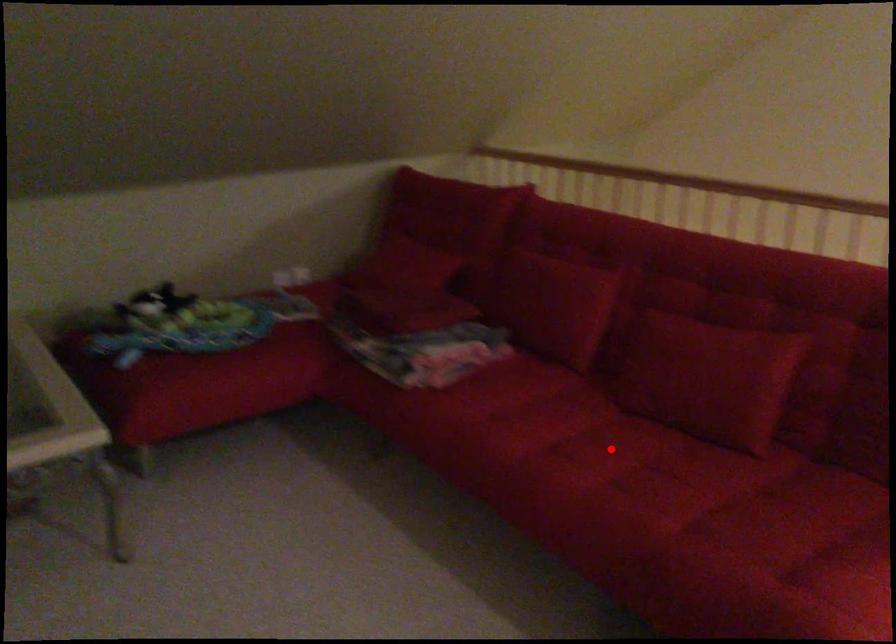
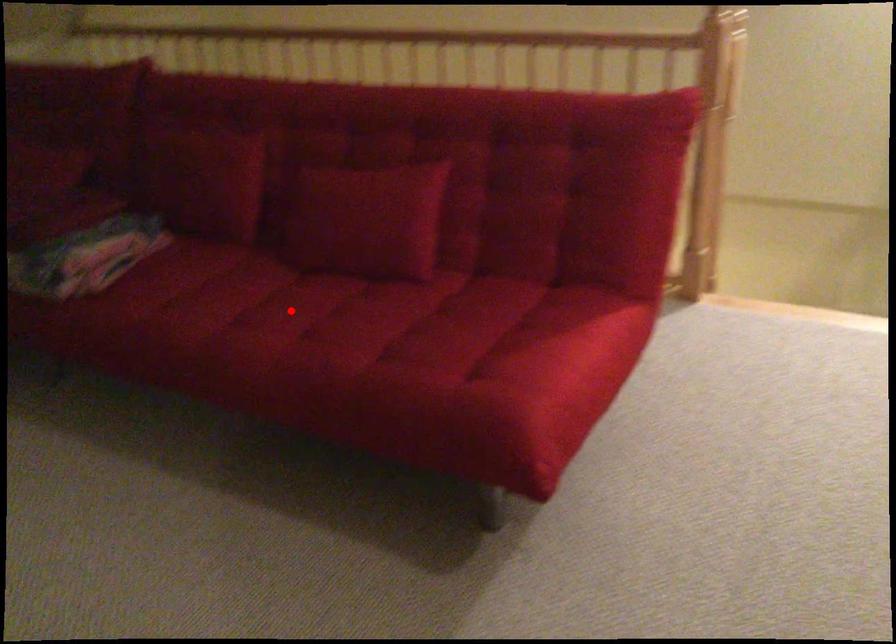
I am providing you with two images of the same scene from different viewpoints. A red point is marked on the first image and another point is marked on the second image. Does the point marked in image1 correspond to the same location as the one in image2?

Yes